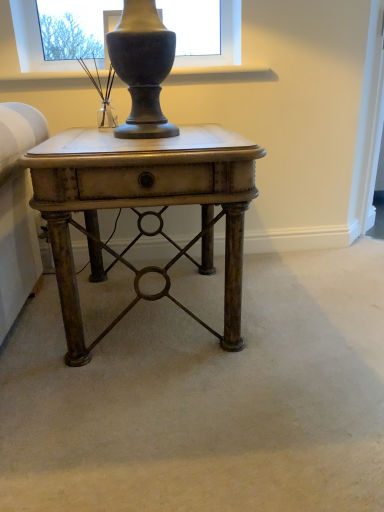
Question: Should I look upward or downward to see matte brown wood table at center?

Choices:
 (A) up
 (B) down

Answer: (A)